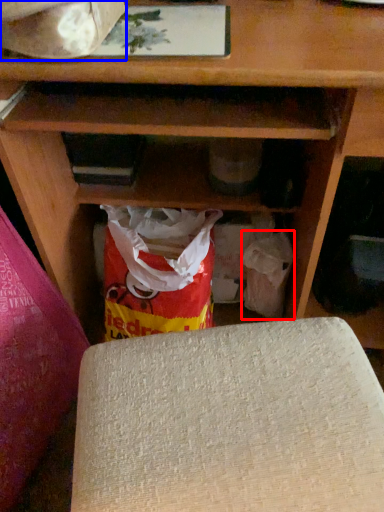
Question: Which object appears farthest to the camera in this image, grocery bag (highlighted by a red box) or wrapping paper (highlighted by a blue box)?

Choices:
 (A) grocery bag
 (B) wrapping paper

Answer: (A)